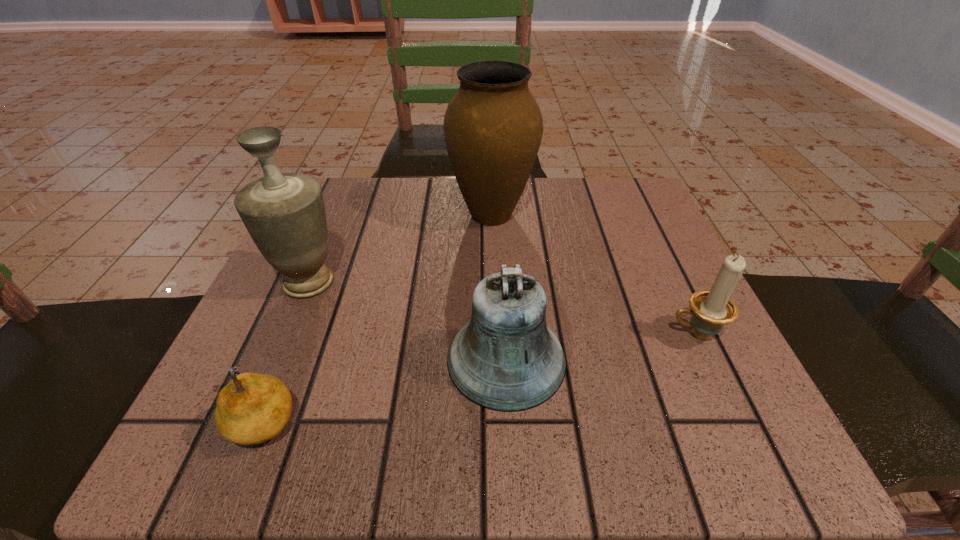
Where is `the farthest object`? This screenshot has width=960, height=540. the farthest object is located at coordinates (493, 127).

Identify the location of the farther urn. The height and width of the screenshot is (540, 960). (493, 127).

This screenshot has width=960, height=540. Identify the location of the left urn. pyautogui.click(x=284, y=213).

Identify the location of the fourth nearest object. (284, 213).

At what (x,y) coordinates should I click in order to perform the action: click on bell. Please return your answer as a coordinate pair (x, y). The width and height of the screenshot is (960, 540). Looking at the image, I should click on (506, 359).

Locate an element on the screen. The image size is (960, 540). the rightmost object is located at coordinates (711, 309).

Identify the location of the shortest object. (253, 408).

Locate an element on the screen. vacant space situated on the left of the farthest object is located at coordinates (344, 215).

Where is `free space located on the back of the second farthest object`? free space located on the back of the second farthest object is located at coordinates pos(326,240).

Locate an element on the screen. Image resolution: width=960 pixels, height=540 pixels. free region located on the back of the bell is located at coordinates (500, 241).